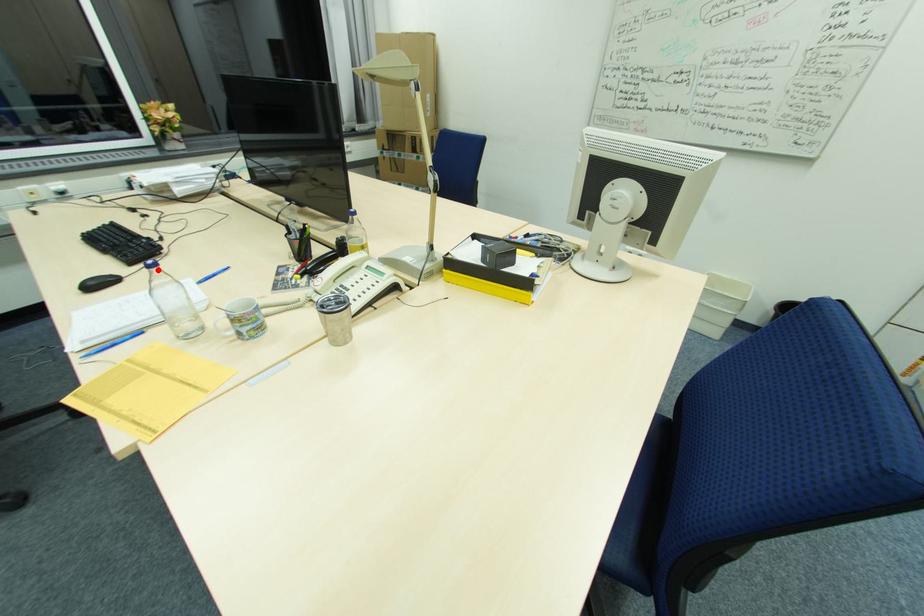
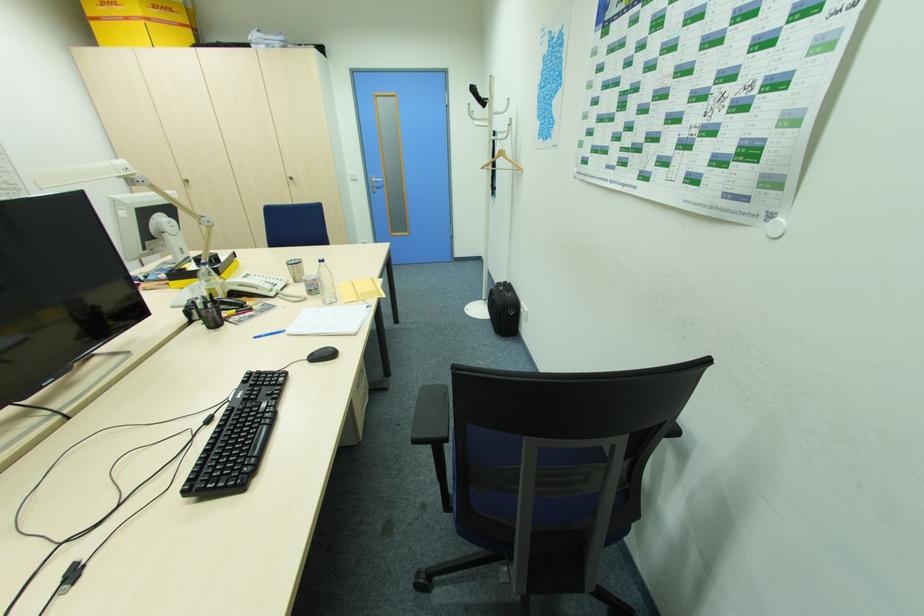
Question: I am providing you with two images of the same scene from different viewpoints. Image1 has a red point marked. In image2, the corresponding 3D location appears at what relative position? Reply with the corresponding letter.

Choices:
 (A) Closer
 (B) Farther

Answer: (A)